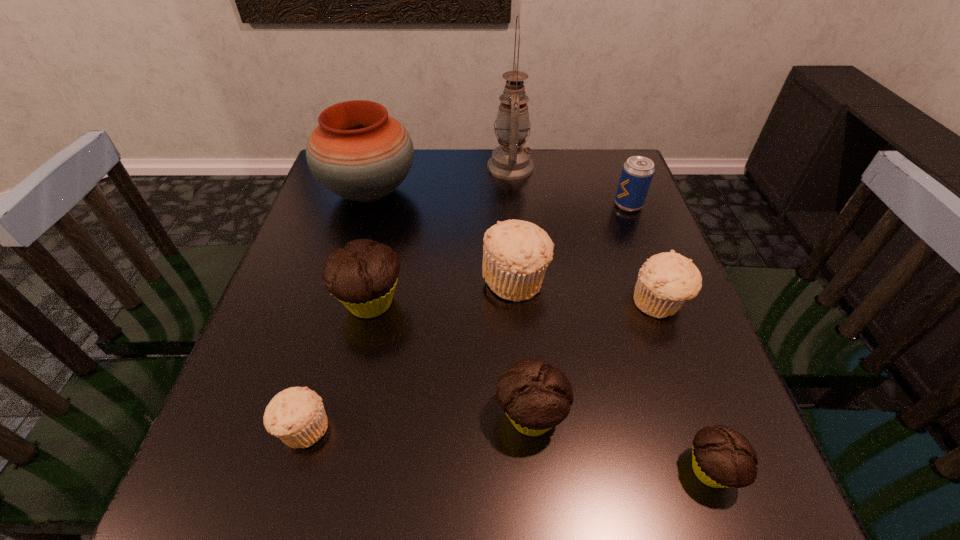
This screenshot has width=960, height=540. Identify the location of the smallest beige muffin. (296, 415).

Locate an element on the screen. This screenshot has width=960, height=540. the leftmost beige muffin is located at coordinates (296, 415).

Identify the location of the smallest chocolate muffin. This screenshot has height=540, width=960. (721, 457).

Find the location of a particular element. Image resolution: width=960 pixels, height=540 pixels. free spot located on the left of the oil lamp is located at coordinates (443, 167).

Find the location of a particular element. The height and width of the screenshot is (540, 960). free space located on the right of the second tallest object is located at coordinates (564, 192).

Identify the location of vacant space located 0.230m on the left of the biggest beige muffin. (378, 279).

Image resolution: width=960 pixels, height=540 pixels. I want to click on free spot located 0.170m on the front of the farthest chocolate muffin, so click(346, 412).

Identify the location of vacant area situated on the back of the beer can. The width and height of the screenshot is (960, 540). (620, 184).

You are a GUI agent. You are given a task and a screenshot of the screen. Output one action in this format:
    pyautogui.click(x=<x>, y=<y>)
    Task: Click on the free space located 0.230m on the back of the rightmost beige muffin
    The width and height of the screenshot is (960, 540).
    Given the screenshot: What is the action you would take?
    pyautogui.click(x=627, y=217)

Image resolution: width=960 pixels, height=540 pixels. What are the coordinates of `free space located on the back of the second chocolate muffin from right to left` in the screenshot? It's located at (516, 255).